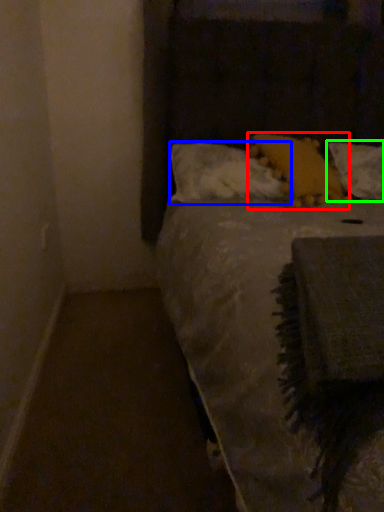
Question: Which is nearer to the pillow (highlighted by a red box)? pillow (highlighted by a blue box) or pillow (highlighted by a green box).

Choices:
 (A) pillow
 (B) pillow

Answer: (A)